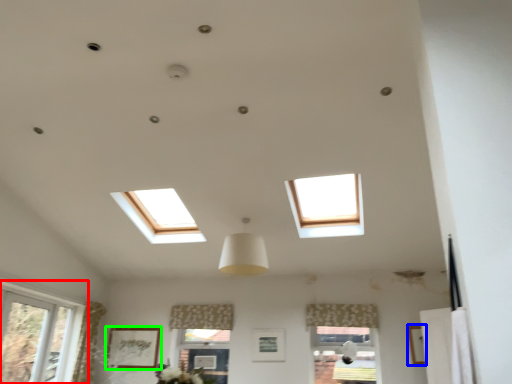
Question: Which is farther away from window (highlighted by a red box)? picture frame (highlighted by a blue box) or picture frame (highlighted by a green box)?

Choices:
 (A) picture frame
 (B) picture frame

Answer: (A)